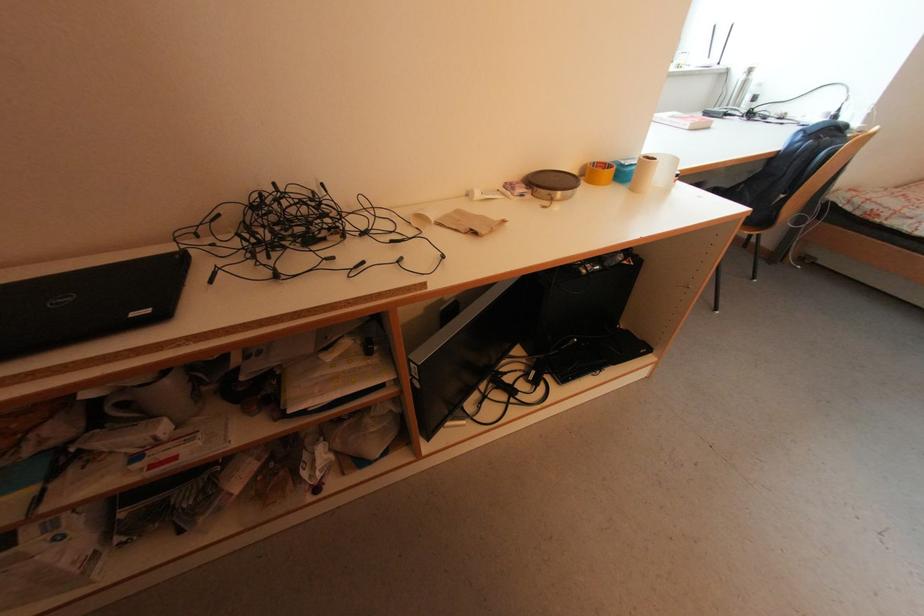
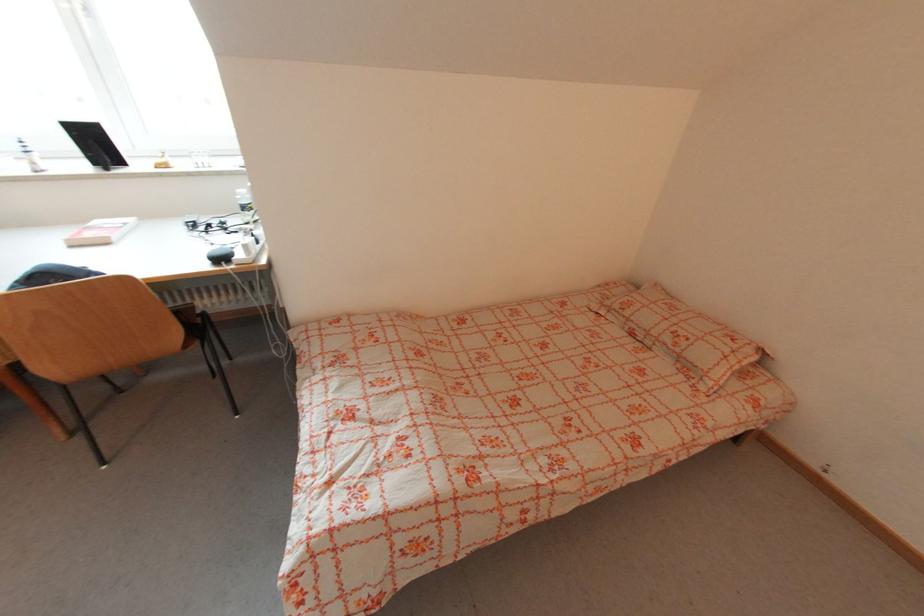
Question: What movement of the cameraman would produce the second image?

Choices:
 (A) Left
 (B) Right
 (C) Forward
 (D) Backward

Answer: (B)